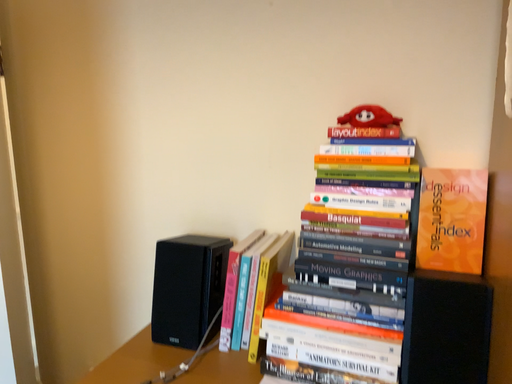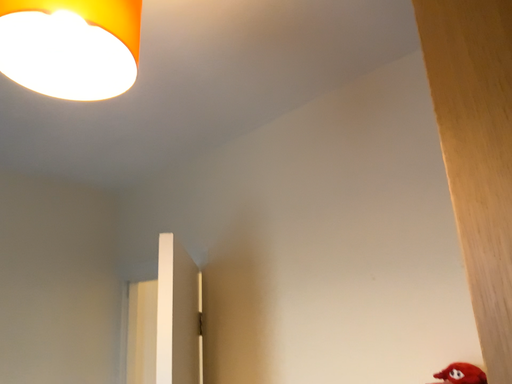
Question: Which way did the camera rotate in the video?

Choices:
 (A) rotated right
 (B) rotated left

Answer: (B)